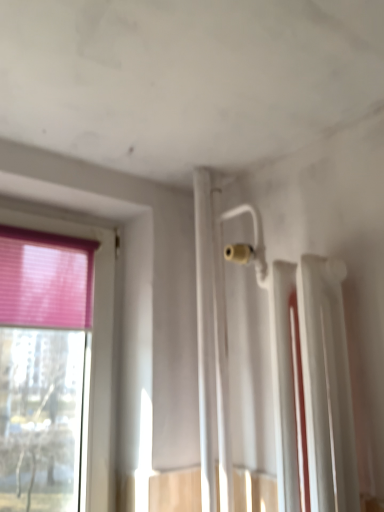
The width and height of the screenshot is (384, 512). What do you see at coordinates (327, 386) in the screenshot?
I see `white glossy radiator at upper right` at bounding box center [327, 386].

Locate an element on the screen. white glossy radiator at upper right is located at coordinates (327, 386).

Measure the distance between white glossy radiator at upper right and camera.

white glossy radiator at upper right and camera are 32.99 inches apart.

What is the approximate width of white glossy radiator at upper right?

white glossy radiator at upper right is 7.14 inches wide.

This screenshot has height=512, width=384. I want to click on pink fabric curtain at left, so click(45, 279).

Describe the element at coordinates (45, 279) in the screenshot. I see `pink fabric curtain at left` at that location.

Where is `white glossy radiator at upper right`? The image size is (384, 512). white glossy radiator at upper right is located at coordinates (327, 386).

Between white glossy radiator at upper right and pink fabric curtain at left, which one appears on the right side from the viewer's perspective?

Positioned to the right is white glossy radiator at upper right.

Which object is closer to the camera, white glossy radiator at upper right or pink fabric curtain at left?

white glossy radiator at upper right.

Between point (342, 467) and point (46, 254), which one is positioned behind?

The point (46, 254) is farther from the camera.

From the image's perspective, between white glossy radiator at upper right and pink fabric curtain at left, which one is located above?

pink fabric curtain at left is shown above in the image.

From the picture: From a real-world perspective, which object rests below the other?

In real-world perspective, white glossy radiator at upper right is lower.

Is white glossy radiator at upper right thinner than pink fabric curtain at left?

No, white glossy radiator at upper right is not thinner than pink fabric curtain at left.

Does white glossy radiator at upper right have a greater height compared to pink fabric curtain at left?

Yes, white glossy radiator at upper right is taller than pink fabric curtain at left.

Does white glossy radiator at upper right have a larger size compared to pink fabric curtain at left?

Indeed, white glossy radiator at upper right has a larger size compared to pink fabric curtain at left.

Is white glossy radiator at upper right situated inside pink fabric curtain at left or outside?

white glossy radiator at upper right is spatially situated outside pink fabric curtain at left.

Is white glossy radiator at upper right in contact with pink fabric curtain at left?

white glossy radiator at upper right is not next to pink fabric curtain at left, and they're not touching.

Is white glossy radiator at upper right looking in the opposite direction of pink fabric curtain at left?

No, white glossy radiator at upper right is not facing away from pink fabric curtain at left.

The width and height of the screenshot is (384, 512). I want to click on curtain above the white glossy radiator at upper right (from a real-world perspective), so click(45, 279).

Is pink fabric curtain at left to the right of white glossy radiator at upper right from the viewer's perspective?

Incorrect, pink fabric curtain at left is not on the right side of white glossy radiator at upper right.

Is pink fabric curtain at left positioned before white glossy radiator at upper right?

No, pink fabric curtain at left is further to the viewer.

Considering the positions of points (92, 288) and (319, 362), is point (92, 288) farther from camera compared to point (319, 362)?

Yes, it is behind point (319, 362).

From the image's perspective, is pink fabric curtain at left above white glossy radiator at upper right?

Yes, from the image's perspective, pink fabric curtain at left is above white glossy radiator at upper right.

From a real-world perspective, is pink fabric curtain at left positioned over white glossy radiator at upper right based on gravity?

Correct, in the physical world, pink fabric curtain at left is higher than white glossy radiator at upper right.

Which object is wider, pink fabric curtain at left or white glossy radiator at upper right?

white glossy radiator at upper right is wider.

Does pink fabric curtain at left have a lesser height compared to white glossy radiator at upper right?

Yes, pink fabric curtain at left is shorter than white glossy radiator at upper right.

In the scene shown: Considering the relative sizes of pink fabric curtain at left and white glossy radiator at upper right in the image provided, is pink fabric curtain at left smaller than white glossy radiator at upper right?

Correct, pink fabric curtain at left occupies less space than white glossy radiator at upper right.

Is white glossy radiator at upper right a part of pink fabric curtain at left?

No, pink fabric curtain at left does not contain white glossy radiator at upper right.

Are pink fabric curtain at left and white glossy radiator at upper right making contact?

No, pink fabric curtain at left is not next to white glossy radiator at upper right.

Is pink fabric curtain at left oriented away from white glossy radiator at upper right?

No, pink fabric curtain at left is not facing the opposite direction of white glossy radiator at upper right.

How many degrees apart are the facing directions of pink fabric curtain at left and white glossy radiator at upper right?

88.6 degrees.

Find the location of a particular element. The height and width of the screenshot is (512, 384). radiator located in front of the pink fabric curtain at left is located at coordinates (327, 386).

Locate an element on the screen. radiator below the pink fabric curtain at left (from a real-world perspective) is located at coordinates (327, 386).

The height and width of the screenshot is (512, 384). In the image, there is a white glossy radiator at upper right. Find the location of `curtain above it (from the image's perspective)`. curtain above it (from the image's perspective) is located at coordinates (45, 279).